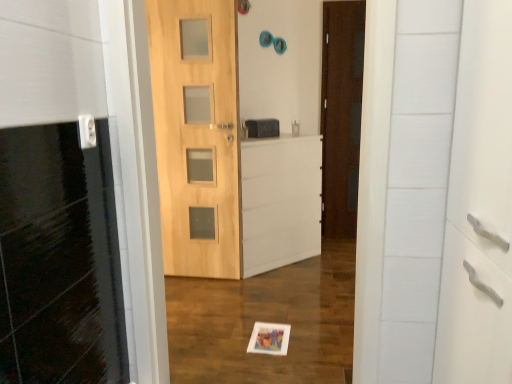
Locate an element on the screen. free spot to the right of white matte file cabinet at center is located at coordinates (324, 261).